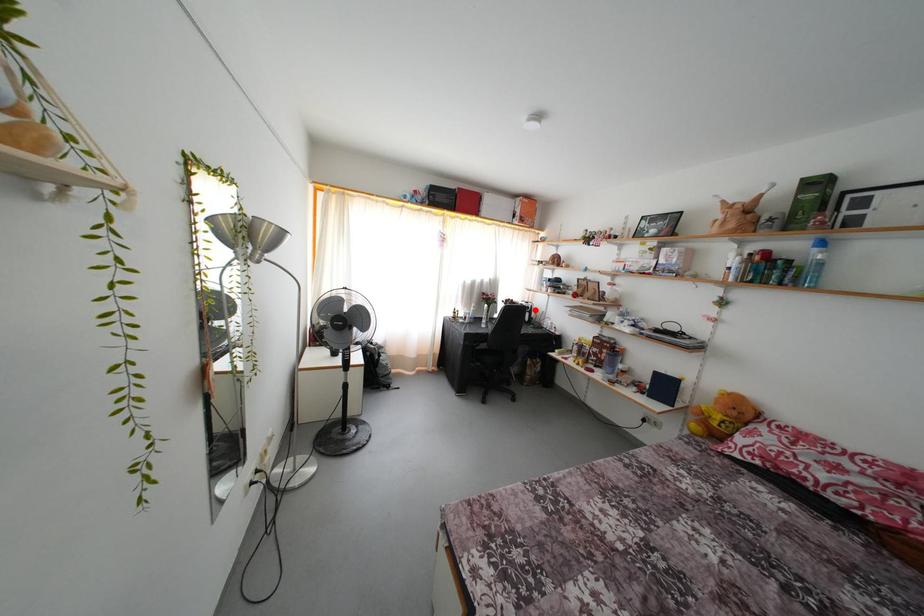
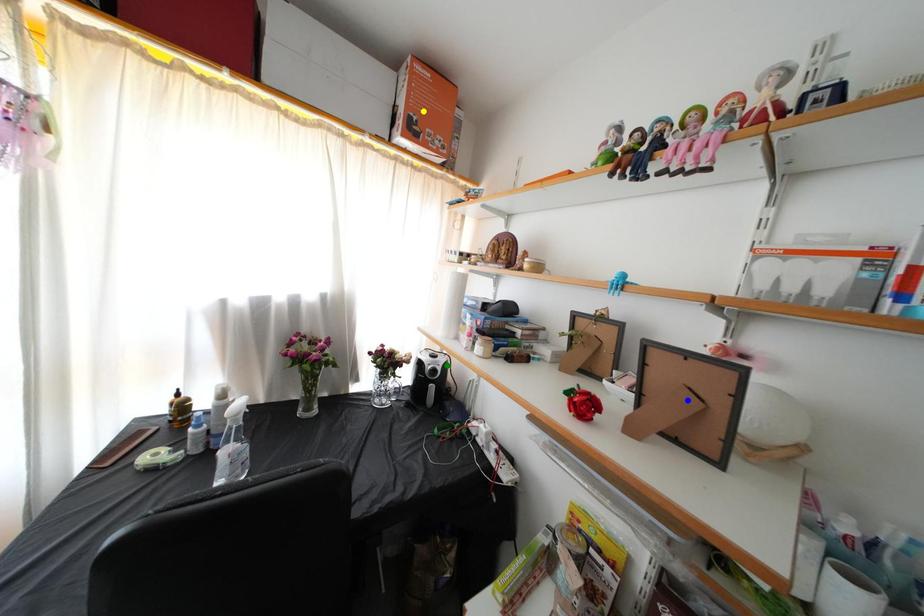
Question: I am providing you with two images of the same scene from different viewpoints. A red point is marked on the first image. You are given multiple points on the second image. Which spot in image 2 lines up with the point in image 1?

Choices:
 (A) green point
 (B) yellow point
 (C) blue point

Answer: (A)